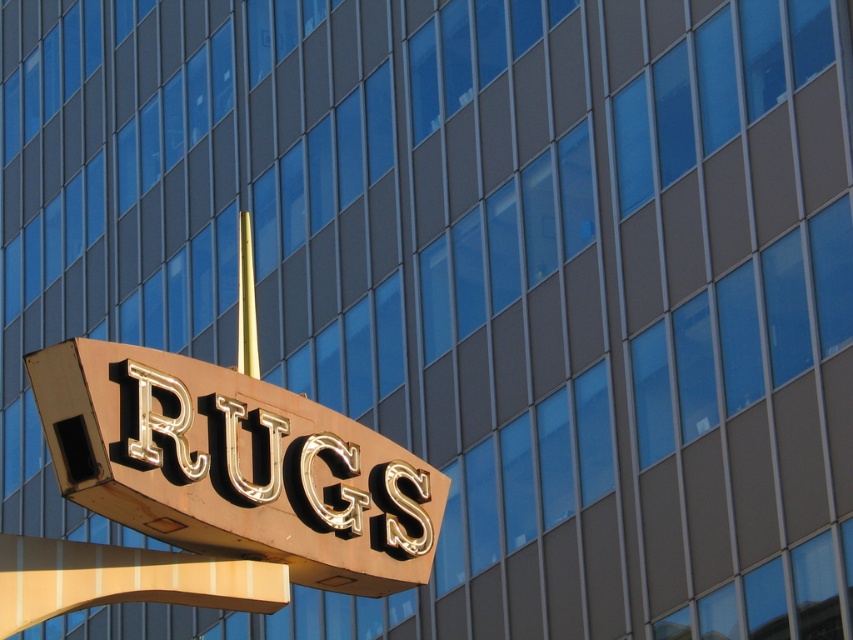
In the scene shown: You are standing in front of the signboard and want to touch both the gold metallic sign at center and the gold polished pole at center. Which one should you reach for first if you want to touch the one on the left first?

You should reach for the gold polished pole at center first because it is positioned to the left of the gold metallic sign at center.